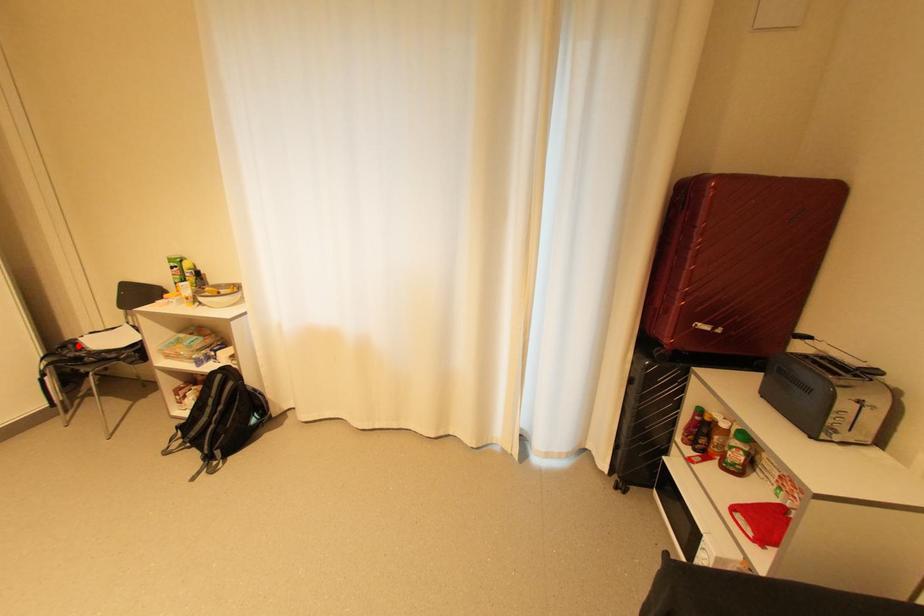
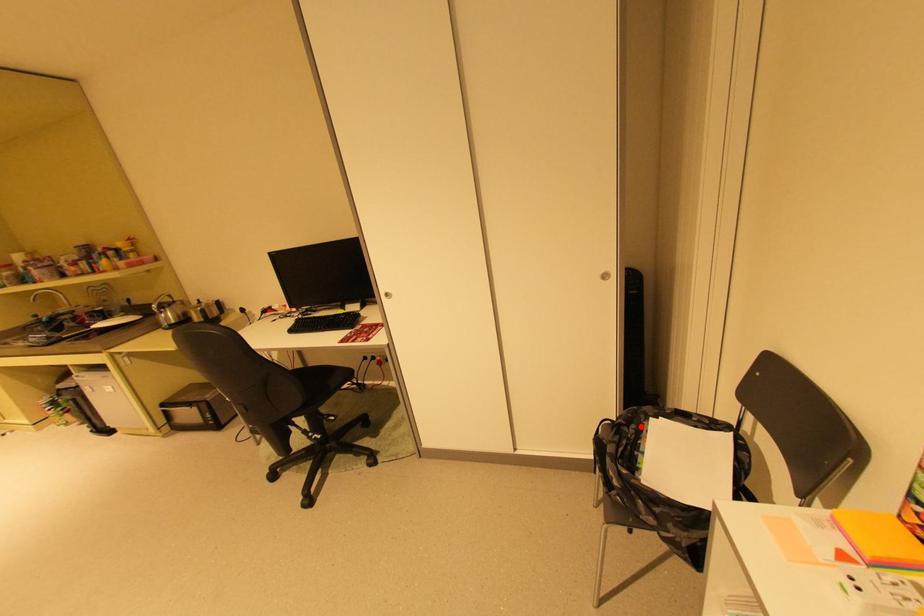
I am providing you with two images of the same scene from different viewpoints. A red point is marked on the first image and another point is marked on the second image. Are the points marked in image1 and image2 representing the same 3D position?

Yes